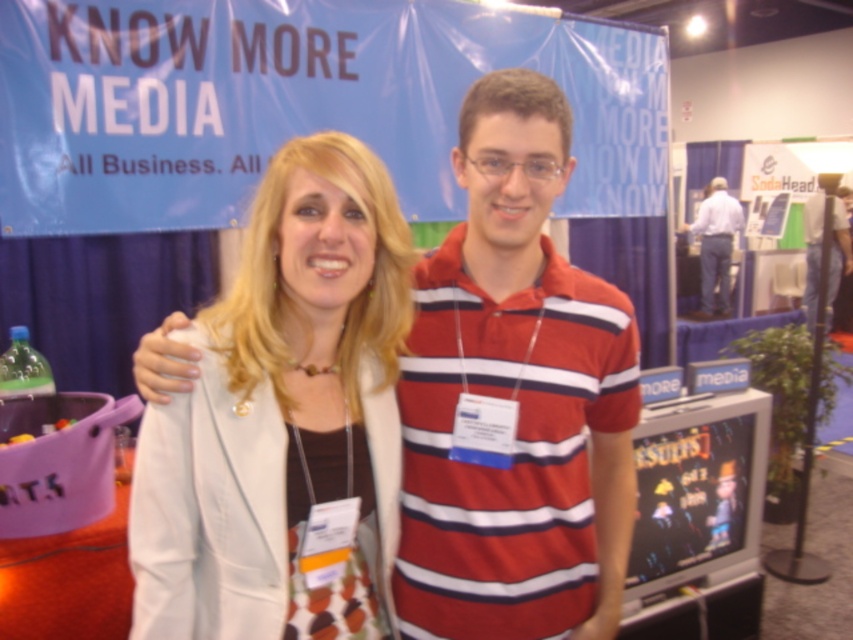
Question: Which point is closer to the camera?

Choices:
 (A) white shirt at center
 (B) striped cotton shirt at center
 (C) white fabric jacket at center
 (D) striped cotton polo shirt at center

Answer: (C)

Question: Which object is positioned closest to the striped cotton polo shirt at center?

Choices:
 (A) striped cotton shirt at center
 (B) white shirt at center
 (C) white fabric jacket at center

Answer: (C)

Question: Is white fabric jacket at center below striped cotton shirt at center?

Choices:
 (A) no
 (B) yes

Answer: (B)

Question: Which point is closer to the camera?

Choices:
 (A) (477, 368)
 (B) (235, 330)
 (C) (817, 298)
 (D) (709, 314)

Answer: (B)

Question: Is striped cotton polo shirt at center above white shirt at center?

Choices:
 (A) yes
 (B) no

Answer: (B)

Question: Can you confirm if white fabric jacket at center is thinner than white shirt at center?

Choices:
 (A) yes
 (B) no

Answer: (A)